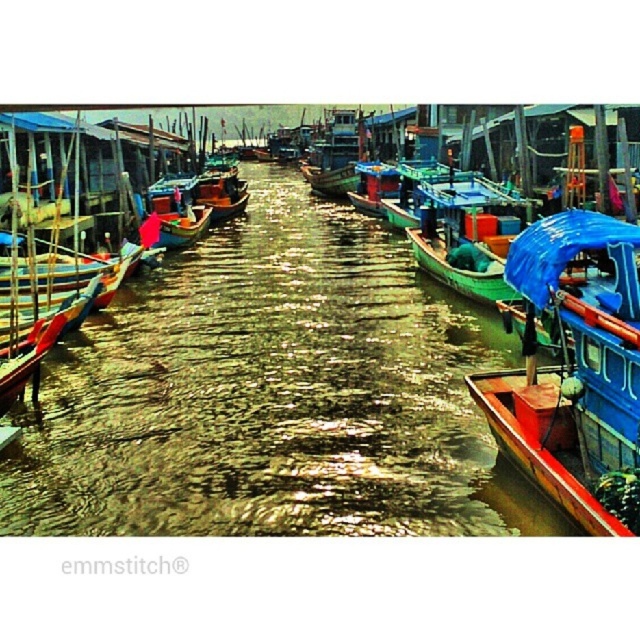
Question: Is wooden canoe at right further to the viewer compared to wooden boat at center?

Choices:
 (A) yes
 (B) no

Answer: (B)

Question: Which object is closer to the camera taking this photo?

Choices:
 (A) green matte canoe at center
 (B) wooden boat at center

Answer: (A)

Question: Can you confirm if wooden boat at center is bigger than green matte canoe at center?

Choices:
 (A) no
 (B) yes

Answer: (B)

Question: Which point is farther to the camera?

Choices:
 (A) (413, 244)
 (B) (513, 371)

Answer: (A)

Question: Does wooden boat at center appear under green matte canoe at center?

Choices:
 (A) yes
 (B) no

Answer: (B)

Question: Which point is farther to the camera?

Choices:
 (A) (172, 195)
 (B) (564, 442)
 (C) (490, 296)

Answer: (A)